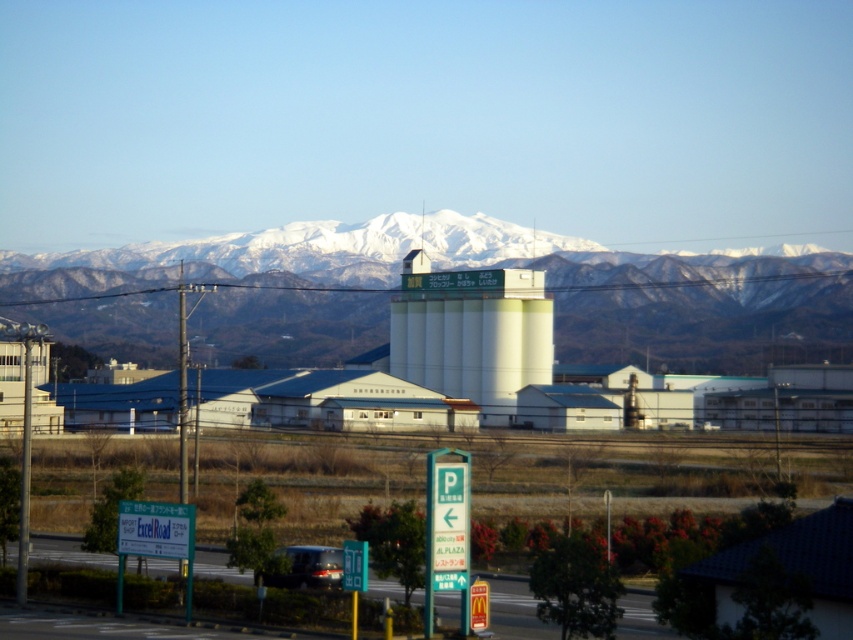
Looking at this image, measure the distance between white matte water tower at center and camera.

white matte water tower at center is 129.80 meters away from camera.

Consider the image. Between white matte water tower at center and green plastic sign at lower center, which one has more height?

With more height is white matte water tower at center.

Find the location of a particular element. white matte water tower at center is located at coordinates (473, 333).

Is white snow-covered mountain range at upper center bigger than matte black car at lower center?

Indeed, white snow-covered mountain range at upper center has a larger size compared to matte black car at lower center.

Does white snow-covered mountain range at upper center have a lesser height compared to matte black car at lower center?

No, white snow-covered mountain range at upper center is not shorter than matte black car at lower center.

Which is in front, point (51, 316) or point (282, 552)?

Point (282, 552)

Where is `white snow-covered mountain range at upper center`? Image resolution: width=853 pixels, height=640 pixels. white snow-covered mountain range at upper center is located at coordinates (668, 296).

Is white snow-covered mountain range at upper center taller than green plastic sign at lower center?

Yes.

Does white snow-covered mountain range at upper center have a lesser width compared to green plastic sign at lower center?

In fact, white snow-covered mountain range at upper center might be wider than green plastic sign at lower center.

Between point (367, 300) and point (438, 502), which one is positioned in front?

Point (438, 502)

At what (x,y) coordinates should I click in order to perform the action: click on white snow-covered mountain range at upper center. Please return your answer as a coordinate pair (x, y). The width and height of the screenshot is (853, 640). Looking at the image, I should click on (668, 296).